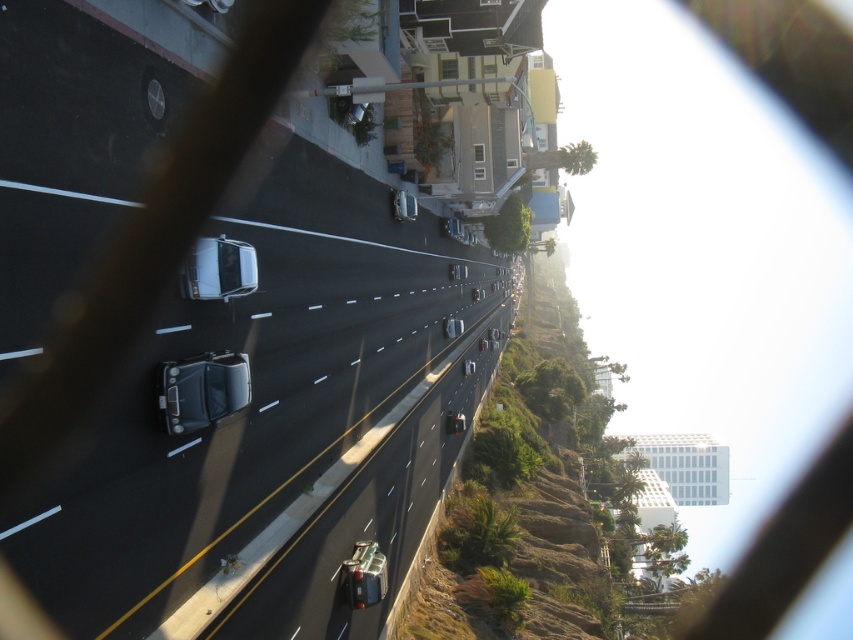
Question: Where is metallic silver car at lower right located in relation to shiny silver sedan at center in the image?

Choices:
 (A) above
 (B) below

Answer: (B)

Question: Is shiny silver car at center thinner than shiny black car at center?

Choices:
 (A) no
 (B) yes

Answer: (A)

Question: Based on their relative distances, which object is farther from the white glossy sedan at center?

Choices:
 (A) shiny silver car at center
 (B) shiny black car at center

Answer: (A)

Question: Considering the real-world distances, which object is farthest from the white glossy sedan at center?

Choices:
 (A) shiny silver sedan at center
 (B) shiny black car at center

Answer: (A)

Question: Which object is positioned closest to the metallic silver car at lower right?

Choices:
 (A) shiny silver sedan at center
 (B) white glossy sedan at center

Answer: (B)

Question: Can you confirm if shiny silver car at center is smaller than metallic silver car at lower right?

Choices:
 (A) no
 (B) yes

Answer: (A)